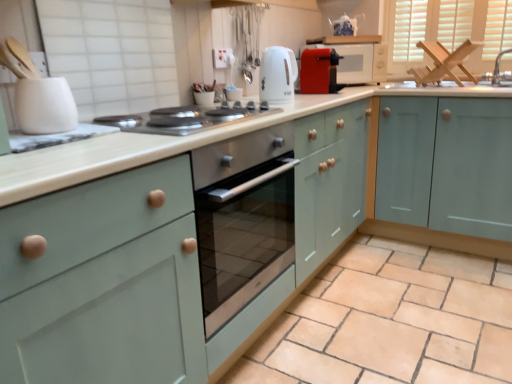
Question: From the image's perspective, is matte red microwave at upper right under blue and white porcelain tea pot at upper center?

Choices:
 (A) yes
 (B) no

Answer: (A)

Question: Is blue and white porcelain tea pot at upper center at the back of matte red microwave at upper right?

Choices:
 (A) yes
 (B) no

Answer: (B)

Question: Is matte red microwave at upper right not within blue and white porcelain tea pot at upper center?

Choices:
 (A) no
 (B) yes

Answer: (B)

Question: Is matte red microwave at upper right to the right of blue and white porcelain tea pot at upper center from the viewer's perspective?

Choices:
 (A) no
 (B) yes

Answer: (A)

Question: Does matte red microwave at upper right come behind blue and white porcelain tea pot at upper center?

Choices:
 (A) yes
 (B) no

Answer: (B)

Question: In terms of height, does wooden frame at upper right look taller or shorter compared to matte red microwave at upper right?

Choices:
 (A) short
 (B) tall

Answer: (B)

Question: Looking at the image, does wooden frame at upper right seem bigger or smaller compared to matte red microwave at upper right?

Choices:
 (A) small
 (B) big

Answer: (A)

Question: Is point (451, 1) closer or farther from the camera than point (385, 48)?

Choices:
 (A) closer
 (B) farther

Answer: (B)

Question: From the image's perspective, is wooden frame at upper right above or below matte red microwave at upper right?

Choices:
 (A) above
 (B) below

Answer: (A)

Question: Considering the relative positions of white glossy electric kettle at upper center, the second kitchen appliance positioned from the bottom, and teal matte cabinet at right in the image provided, is white glossy electric kettle at upper center, the second kitchen appliance positioned from the bottom, to the left or to the right of teal matte cabinet at right?

Choices:
 (A) right
 (B) left

Answer: (B)

Question: Considering their positions, is white glossy electric kettle at upper center, acting as the second kitchen appliance starting from the top, located in front of or behind teal matte cabinet at right?

Choices:
 (A) front
 (B) behind

Answer: (A)

Question: Considering the positions of point (272, 74) and point (498, 251), is point (272, 74) closer or farther from the camera than point (498, 251)?

Choices:
 (A) farther
 (B) closer

Answer: (B)

Question: From a real-world perspective, relative to teal matte cabinet at right, is white glossy electric kettle at upper center, the 2th kitchen appliance in the back-to-front sequence, vertically above or below?

Choices:
 (A) below
 (B) above

Answer: (B)

Question: Would you say wooden frame at upper right is inside or outside stainless steel cooktop at center?

Choices:
 (A) inside
 (B) outside

Answer: (B)

Question: Based on their sizes in the image, would you say wooden frame at upper right is bigger or smaller than stainless steel cooktop at center?

Choices:
 (A) small
 (B) big

Answer: (B)